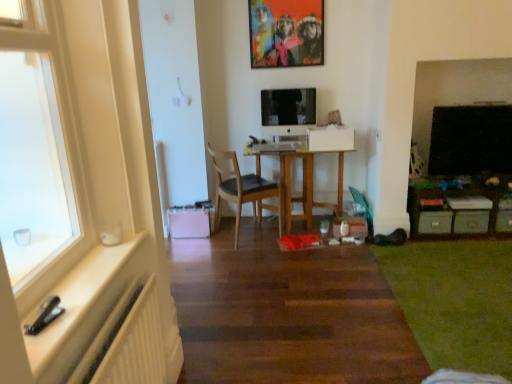
Where is `free location in front of green matte drawer at lower right, which is the 1th drawer in right-to-left order`? free location in front of green matte drawer at lower right, which is the 1th drawer in right-to-left order is located at coordinates (478, 239).